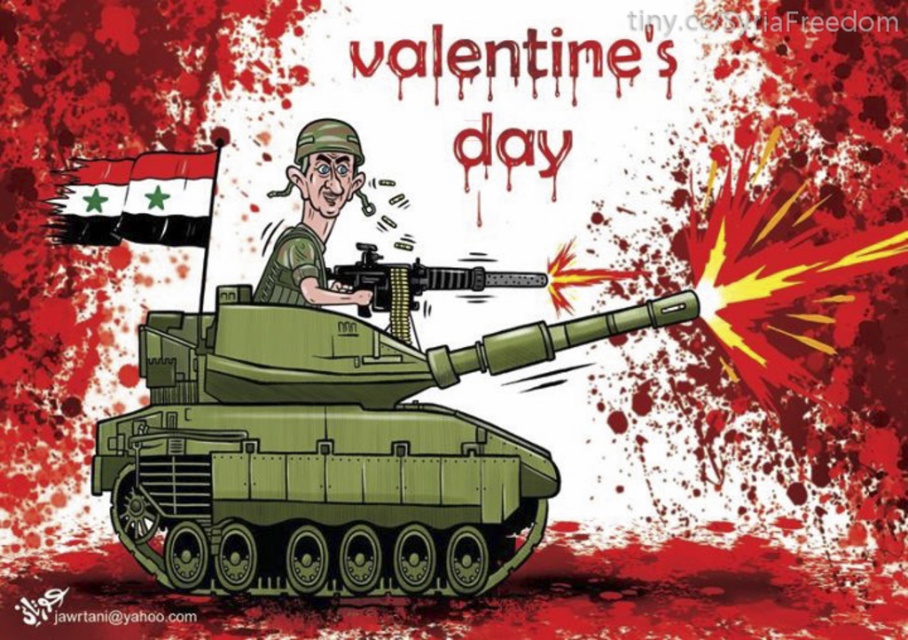
What is located at the coordinate point [135,198] in the image?

A black fabric flag at upper left is located at the coordinate point [135,198].

You are a military analyst examining the cartoon. The scene shows a tank with a soldier and two objects. Based on their sizes, which object is shorter between the black fabric flag at upper left and the matte green uniform at center?

The black fabric flag at upper left is not as tall as the matte green uniform at center, so the black fabric flag at upper left is shorter.

You are a drone operator trying to avoid the black fabric flag at upper left. If you are 7.38 feet away from it, can you safely fly your drone past it without hitting the flag?

The black fabric flag at upper left is 7.38 feet away from you, so yes, you can safely fly your drone past it without hitting the flag as long as you maintain that distance.